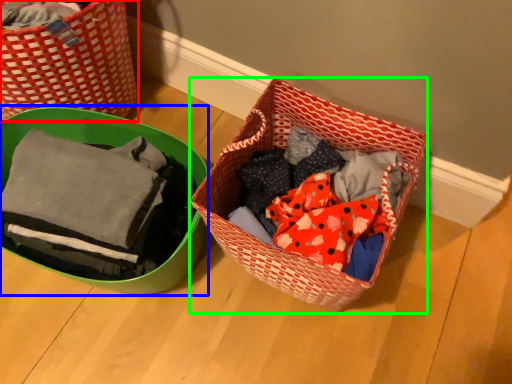
Question: Which object is positioned farthest from picnic basket (highlighted by a red box)? Select from gift basket (highlighted by a blue box) and picnic basket (highlighted by a green box).

Choices:
 (A) gift basket
 (B) picnic basket

Answer: (B)